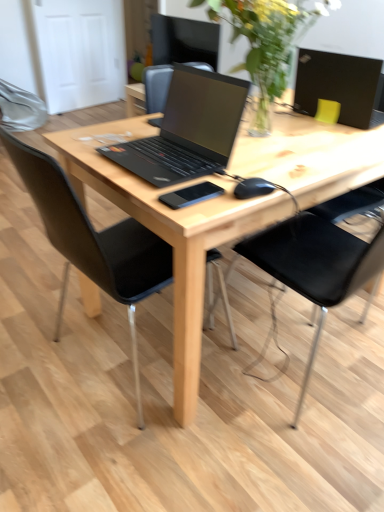
The image size is (384, 512). Find the location of `vacant region to the left of black matte mouse at center`. vacant region to the left of black matte mouse at center is located at coordinates (194, 197).